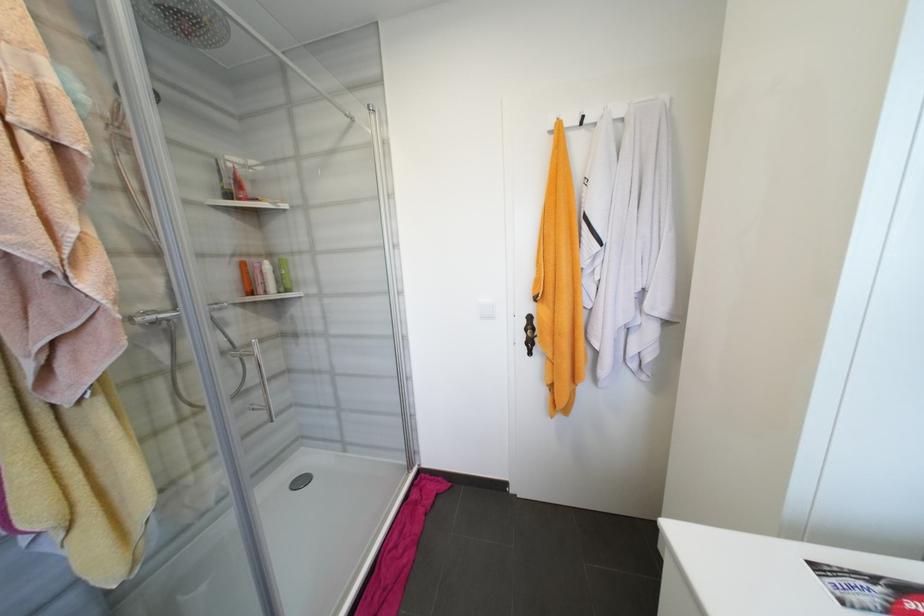
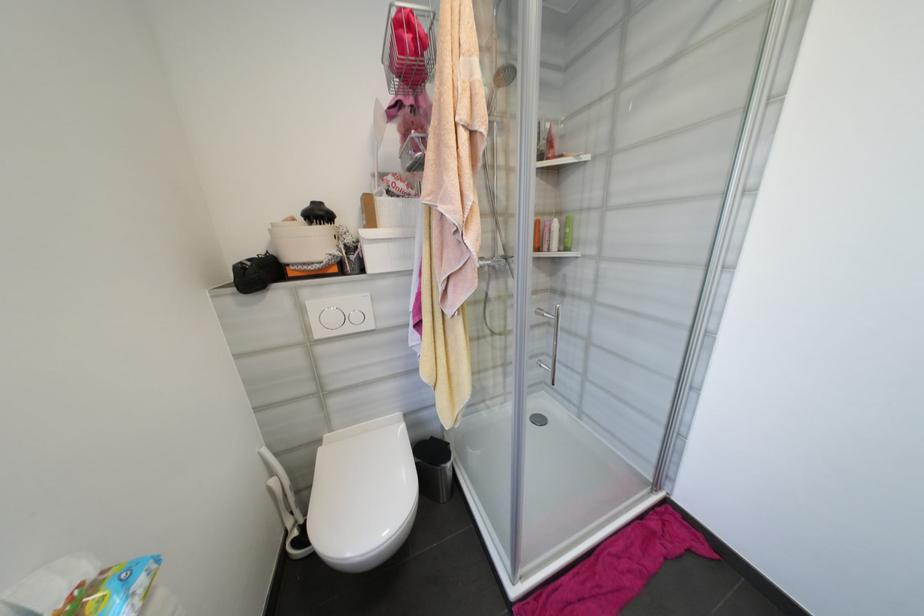
Find the pixel in the second image that matches pixel 82 145 in the first image.

(488, 127)